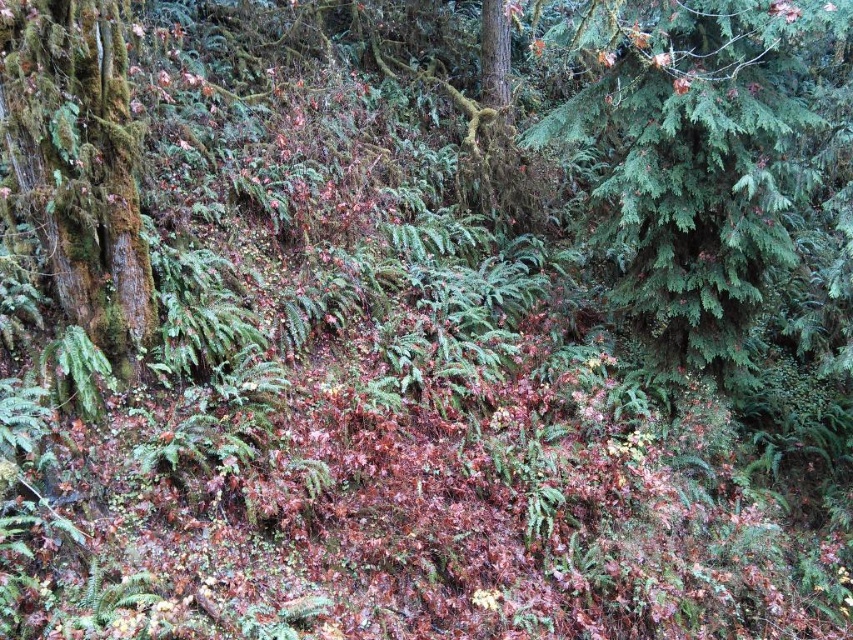
Is green needle-like at upper right taller than green mossy tree at left?

Yes, green needle-like at upper right is taller than green mossy tree at left.

Which of these two, green needle-like at upper right or green mossy tree at left, stands shorter?

With less height is green mossy tree at left.

The width and height of the screenshot is (853, 640). Describe the element at coordinates (697, 157) in the screenshot. I see `green needle-like at upper right` at that location.

I want to click on green needle-like at upper right, so click(697, 157).